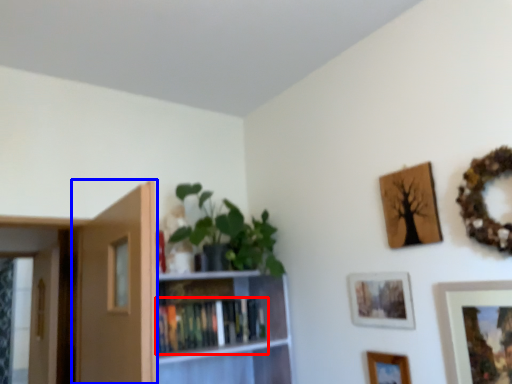
Question: Among these objects, which one is nearest to the camera, book (highlighted by a red box) or door (highlighted by a blue box)?

Choices:
 (A) book
 (B) door

Answer: (B)